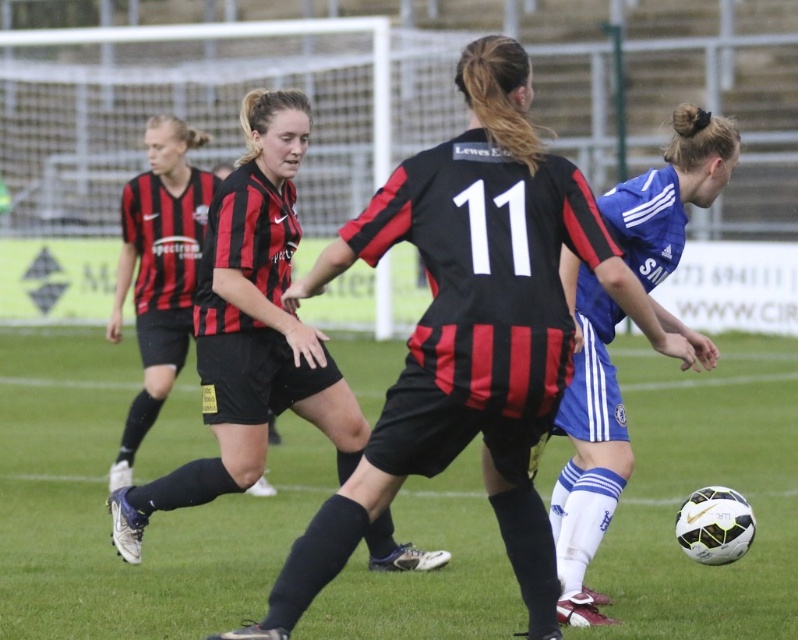
You are a soccer coach analyzing the field layout. Which object occupies more space in the image, the green grass football field at center or the black matte soccer jersey at center?

The green grass football field at center has a larger size compared to the black matte soccer jersey at center, so the green grass football field at center occupies more space in the image.

You are a soccer coach analyzing the match. You notice the green grass football field at center and the blue jersey at center. Which object is taller?

The blue jersey at center is taller than the green grass football field at center.

You are a soccer player positioned at the point with coordinates (105, 513). Which object are you standing on?

The point with coordinates (105, 513) corresponds to the green grass football field at center, so you are standing on the green grass football field at center.